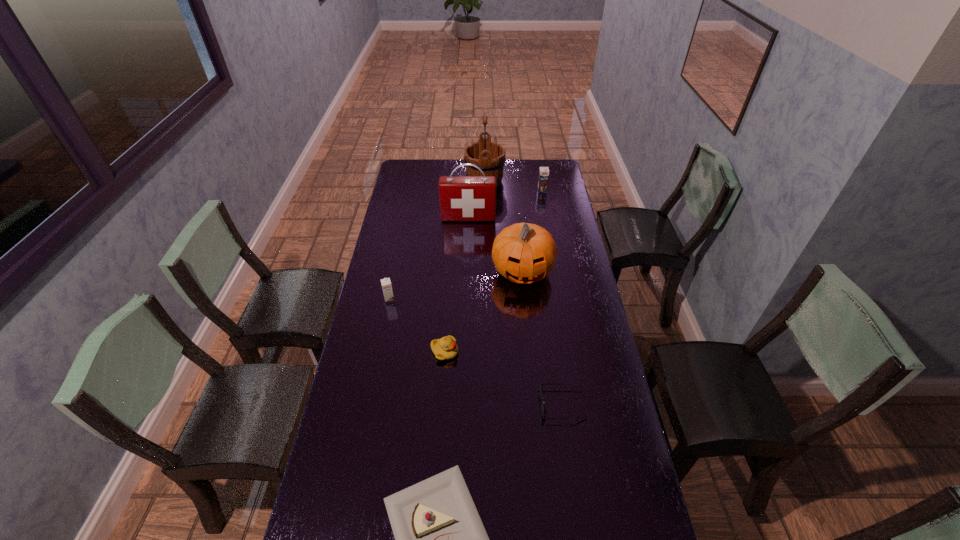
Find the location of a particular element. This screenshot has width=960, height=540. free space that satisfies the following two spatial constraints: 1. on the front label of the right chocolate milk; 2. on the front-facing side of the sunglasses is located at coordinates (581, 404).

Where is `free space that satisfies the following two spatial constraints: 1. on the front-facing side of the fourth farthest object; 2. on the front-facing side of the sixth farthest object`? free space that satisfies the following two spatial constraints: 1. on the front-facing side of the fourth farthest object; 2. on the front-facing side of the sixth farthest object is located at coordinates (531, 352).